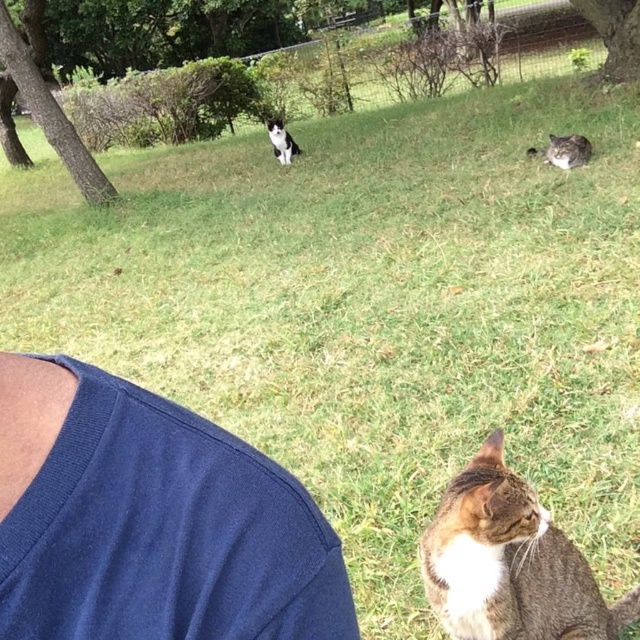
Which of these two, tabby fur cat at center or black and white fur cat at upper center, stands shorter?

With less height is black and white fur cat at upper center.

How distant is tabby fur cat at center from black and white fur cat at upper center?

tabby fur cat at center and black and white fur cat at upper center are 6.28 meters apart from each other.

Is point (525, 541) positioned before point (275, 136)?

Yes, point (525, 541) is in front of point (275, 136).

This screenshot has height=640, width=640. Find the location of `tabby fur cat at center`. tabby fur cat at center is located at coordinates (509, 563).

Can you confirm if tabby fur cat at center is positioned to the left of fuzzy gray cat at upper right?

Indeed, tabby fur cat at center is positioned on the left side of fuzzy gray cat at upper right.

Between tabby fur cat at center and fuzzy gray cat at upper right, which one is positioned higher?

Positioned higher is fuzzy gray cat at upper right.

What are the coordinates of `tabby fur cat at center` in the screenshot? It's located at (509, 563).

Can you confirm if navy blue fabric at lower left is positioned above fuzzy gray cat at upper right?

Incorrect, navy blue fabric at lower left is not positioned above fuzzy gray cat at upper right.

Is point (45, 468) farther from camera compared to point (532, 156)?

No, it is in front of (532, 156).

Find the location of a particular element. The image size is (640, 640). navy blue fabric at lower left is located at coordinates (150, 520).